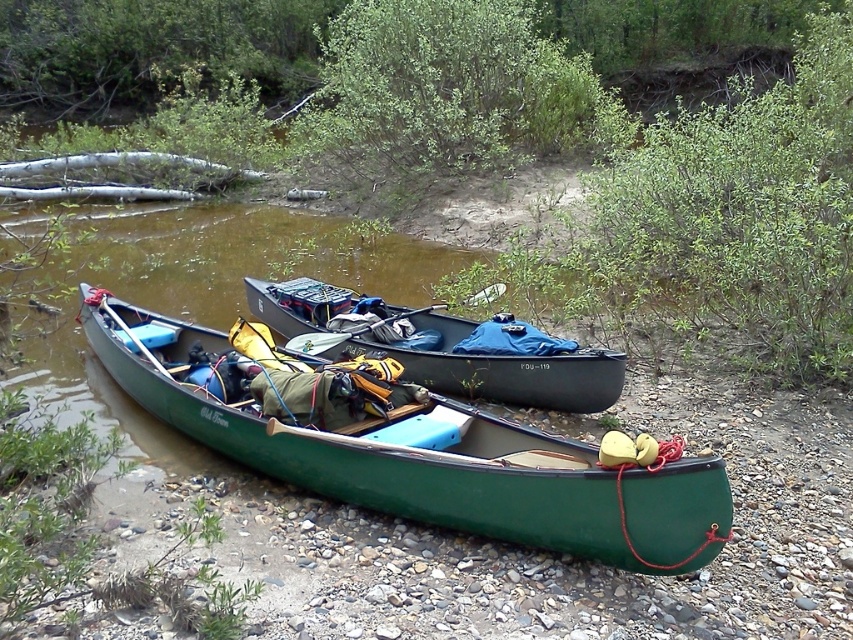
Does point (537, 436) come behind point (560, 356)?

No.

Identify the location of green matte canoe at lower left. (410, 444).

Does matte black canoe at center have a greater width compared to wooden paddle at center?

Correct, the width of matte black canoe at center exceeds that of wooden paddle at center.

Is point (393, 349) farther from viewer compared to point (132, 333)?

No, it is not.

Does point (265, 307) come in front of point (158, 362)?

No, (265, 307) is behind (158, 362).

I want to click on matte black canoe at center, so [x=498, y=368].

Can you confirm if matte black canoe at center is taller than white plastic paddle at center?

Indeed, matte black canoe at center has a greater height compared to white plastic paddle at center.

Who is more distant from viewer, (302, 323) or (306, 332)?

Positioned behind is point (302, 323).

Locate an element on the screen. matte black canoe at center is located at coordinates (x=498, y=368).